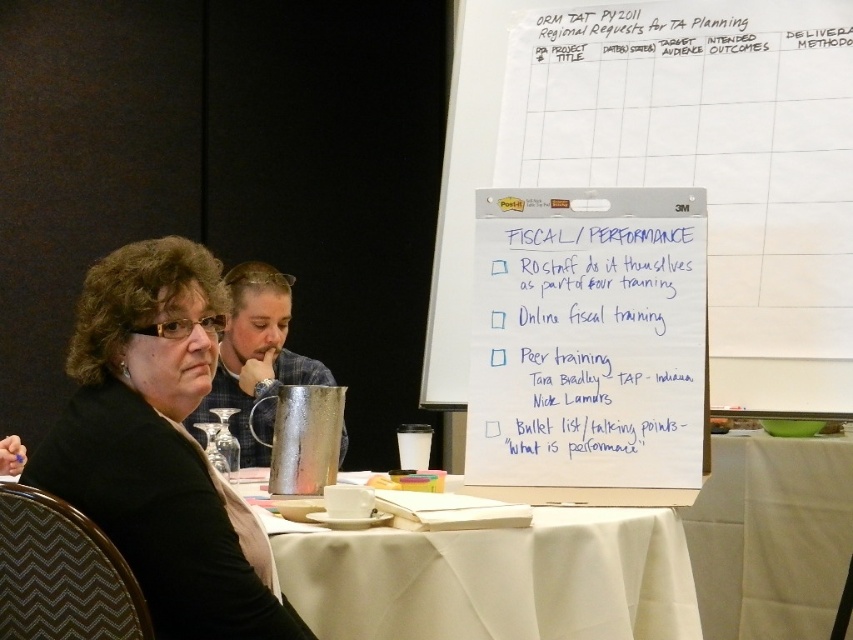
Question: Observing the image, what is the correct spatial positioning of white paperboard at upper right in reference to white cloth at center?

Choices:
 (A) above
 (B) below

Answer: (A)

Question: Which is nearer to the white cloth at lower right?

Choices:
 (A) white cloth at center
 (B) black fabric jacket at left

Answer: (A)

Question: Estimate the real-world distances between objects in this image. Which object is closer to the white paperboard at upper right?

Choices:
 (A) black fabric jacket at left
 (B) brushed metal pitcher at center
 (C) white paperboard at upper center
 (D) white cloth at center

Answer: (C)

Question: Is black fabric jacket at left in front of white cloth at center?

Choices:
 (A) no
 (B) yes

Answer: (B)

Question: Based on their relative distances, which object is farther from the white cloth at center?

Choices:
 (A) white paperboard at upper right
 (B) white cloth at lower right
 (C) brushed metal pitcher at center
 (D) black fabric jacket at left

Answer: (B)

Question: Can you confirm if white paperboard at upper center is smaller than white cloth at center?

Choices:
 (A) yes
 (B) no

Answer: (A)